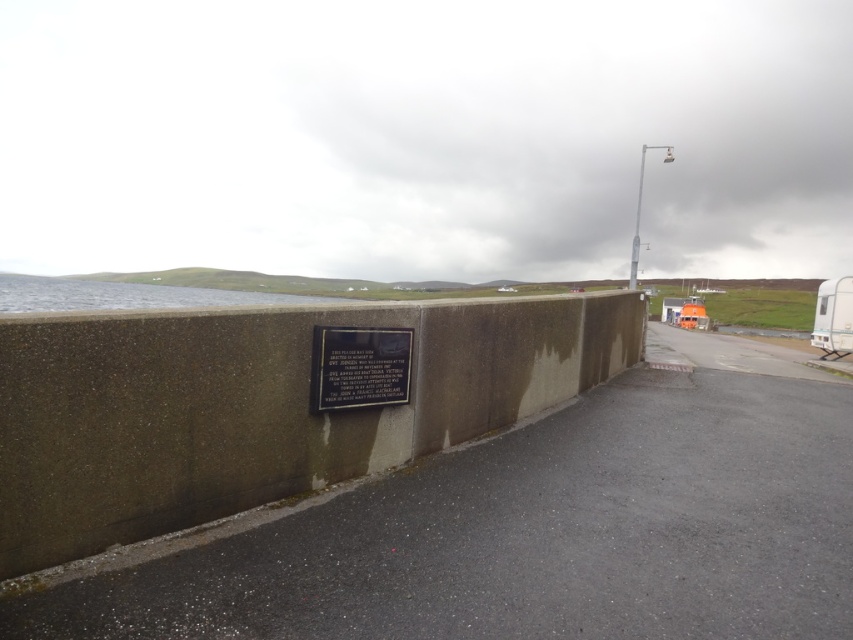
Question: Is concrete wall at center wider than black polished stone plaque at center?

Choices:
 (A) yes
 (B) no

Answer: (A)

Question: Among these points, which one is nearest to the camera?

Choices:
 (A) (358, 376)
 (B) (526, 404)

Answer: (A)

Question: Which object is the closest to the concrete wall at center?

Choices:
 (A) black polished stone plaque at center
 (B) metallic pole at upper right

Answer: (A)

Question: Does concrete wall at center have a lesser width compared to metallic pole at upper right?

Choices:
 (A) no
 (B) yes

Answer: (B)

Question: Is concrete wall at center thinner than metallic pole at upper right?

Choices:
 (A) yes
 (B) no

Answer: (A)

Question: Which point is farther from the camera taking this photo?

Choices:
 (A) (643, 173)
 (B) (172, 480)
 (C) (363, 356)

Answer: (A)